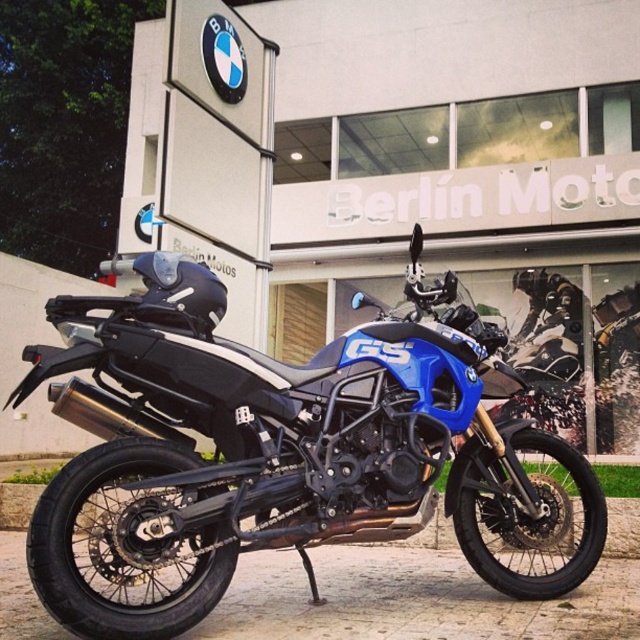
Question: Is blue matte motorcycle at center wider than blue matte/satin gs motorcycle at center?

Choices:
 (A) yes
 (B) no

Answer: (A)

Question: Which point appears farthest from the camera in this image?

Choices:
 (A) (179, 316)
 (B) (339, 278)

Answer: (B)

Question: Among these objects, which one is farthest from the camera?

Choices:
 (A) blue matte motorcycle at center
 (B) blue matte/satin gs motorcycle at center

Answer: (A)

Question: Where is blue matte motorcycle at center located in relation to blue matte/satin gs motorcycle at center in the image?

Choices:
 (A) above
 (B) below

Answer: (A)

Question: Does blue matte motorcycle at center lie behind blue matte/satin gs motorcycle at center?

Choices:
 (A) no
 (B) yes

Answer: (B)